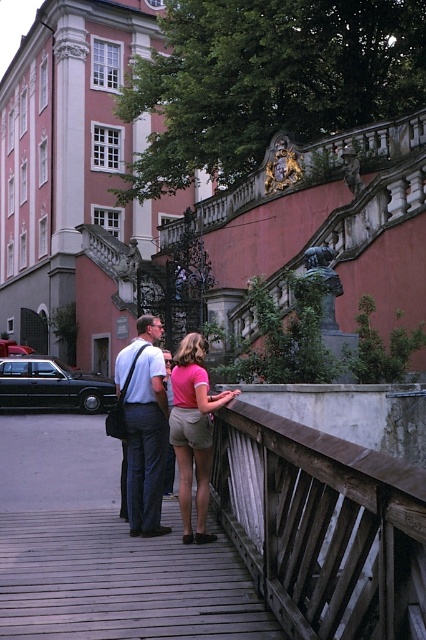
Question: Which point is farther to the camera?

Choices:
 (A) wooden at center
 (B) matte pink building at upper left

Answer: (B)

Question: Can you confirm if matte pink building at upper left is positioned to the right of pink fabric shirt at center?

Choices:
 (A) yes
 (B) no

Answer: (B)

Question: Which of the following is the farthest from the observer?

Choices:
 (A) matte pink building at upper left
 (B) wooden at center

Answer: (A)

Question: Is matte pink building at upper left bigger than pink fabric shirt at center?

Choices:
 (A) no
 (B) yes

Answer: (B)

Question: Which point is farther from the camera taking this photo?

Choices:
 (A) (172, 497)
 (B) (100, 44)

Answer: (B)

Question: Is wooden at center smaller than pink fabric shirt at center?

Choices:
 (A) no
 (B) yes

Answer: (A)